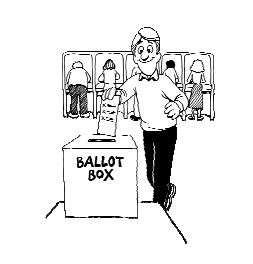
Where is `small white tables`? The height and width of the screenshot is (264, 253). small white tables is located at coordinates (90, 85), (98, 86), (188, 87), (179, 85).